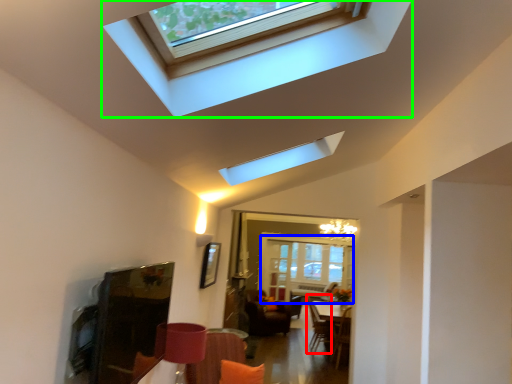
Question: Considering the real-world distances, which object is farthest from swivel chair (highlighted by a red box)? glass door (highlighted by a blue box) or window (highlighted by a green box)?

Choices:
 (A) glass door
 (B) window

Answer: (B)